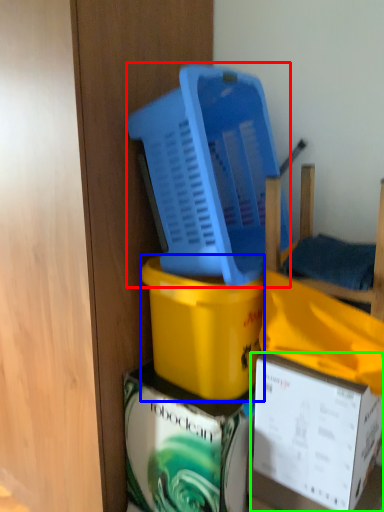
Question: Which is farther away from basket (highlighted by a red box)? box (highlighted by a blue box) or box (highlighted by a green box)?

Choices:
 (A) box
 (B) box

Answer: (B)